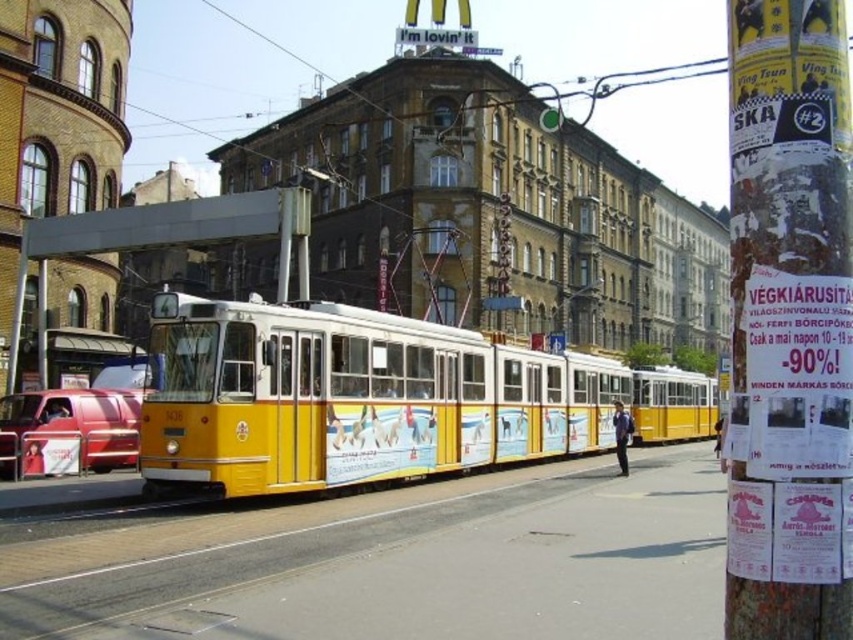
This screenshot has height=640, width=853. In order to click on paper posters at right in this screenshot , I will do `click(788, 323)`.

Can you confirm if paper posters at right is positioned below metallic red van at left?

No, paper posters at right is not below metallic red van at left.

Locate an element on the screen. The image size is (853, 640). paper posters at right is located at coordinates (788, 323).

Where is `paper posters at right`? paper posters at right is located at coordinates (788, 323).